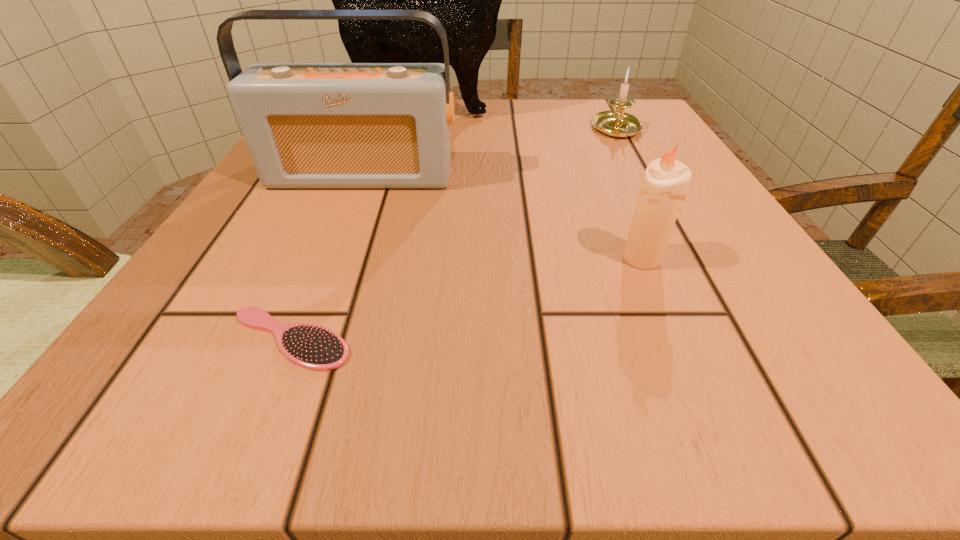
You are a GUI agent. You are given a task and a screenshot of the screen. Output one action in this format:
    pyautogui.click(x=<x>, y=<y>)
    Task: Click on the cat
    The image size is (960, 540).
    Given the screenshot: What is the action you would take?
    pyautogui.click(x=466, y=0)

The image size is (960, 540). In order to click on the third farthest object in this screenshot , I will do `click(307, 125)`.

Locate an element on the screen. Image resolution: width=960 pixels, height=540 pixels. the second tallest object is located at coordinates (307, 125).

You are a GUI agent. You are given a task and a screenshot of the screen. Output one action in this format:
    pyautogui.click(x=<x>, y=<y>)
    Task: Click on the third tallest object
    The height and width of the screenshot is (540, 960).
    Given the screenshot: What is the action you would take?
    pyautogui.click(x=664, y=187)

Where is `the second nearest object`? This screenshot has height=540, width=960. the second nearest object is located at coordinates (664, 187).

Find the location of a particular element. This screenshot has height=540, width=960. the fourth tallest object is located at coordinates (618, 124).

Identify the location of the nearest object. (310, 346).

Find the location of a particular element. Image resolution: width=960 pixels, height=540 pixels. hairbrush is located at coordinates tap(310, 346).

Where is `vacant area situated 0.130m on the face of the cat`? The height and width of the screenshot is (540, 960). vacant area situated 0.130m on the face of the cat is located at coordinates (570, 115).

The image size is (960, 540). Identify the location of vacant space located 0.340m on the front-facing side of the radio receiver. coord(288,360).